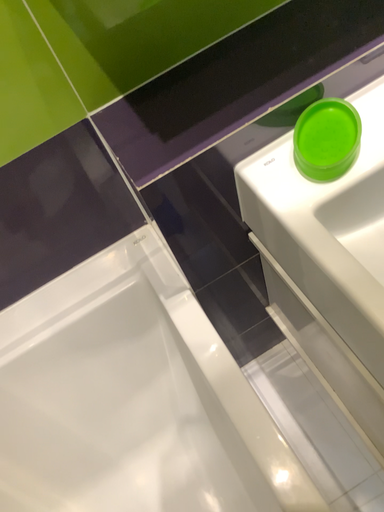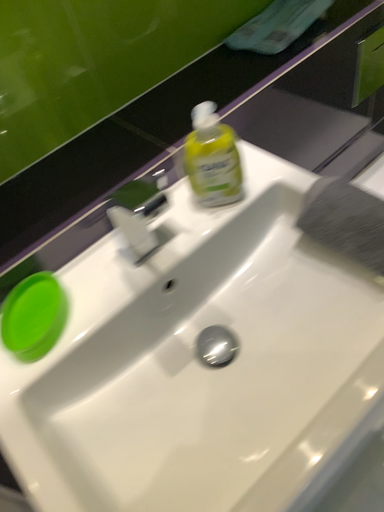
Question: How did the camera likely rotate when shooting the video?

Choices:
 (A) rotated downward
 (B) rotated upward

Answer: (B)